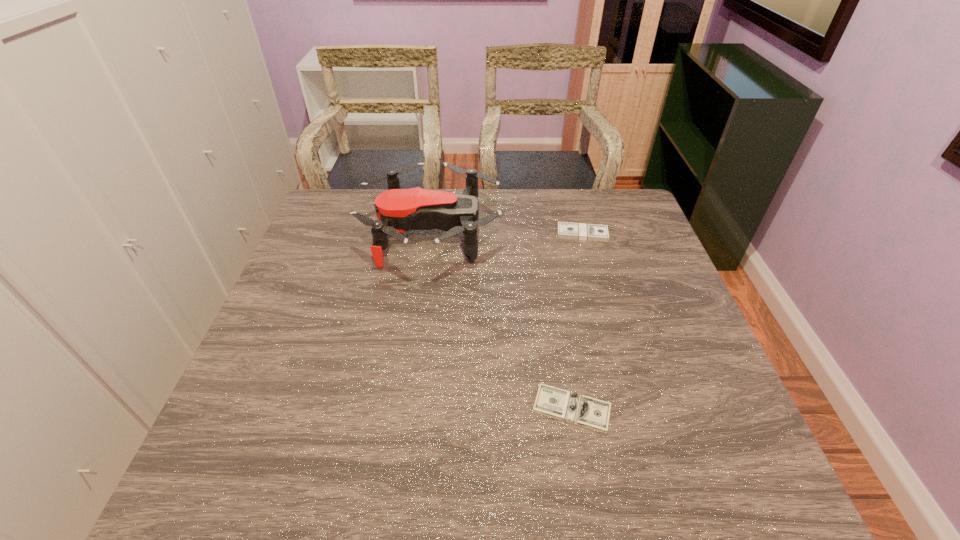
Find the location of a particular element. dollar that is positioned at the far edge is located at coordinates (565, 230).

Where is `object situated at the left edge`? Image resolution: width=960 pixels, height=540 pixels. object situated at the left edge is located at coordinates (398, 210).

In order to click on object positioned at the right edge in this screenshot , I will do `click(565, 230)`.

This screenshot has width=960, height=540. Identify the location of object that is positioned at the far left corner. (398, 210).

The image size is (960, 540). What are the coordinates of `object that is at the far right corner` in the screenshot? It's located at (565, 230).

At what (x,y) coordinates should I click in order to perform the action: click on free space at the far edge of the desktop. Please return your answer as a coordinate pair (x, y). Image resolution: width=960 pixels, height=540 pixels. Looking at the image, I should click on (577, 207).

At what (x,y) coordinates should I click in order to perform the action: click on free space at the near edge of the desktop. Please return your answer as a coordinate pair (x, y). Looking at the image, I should click on (316, 489).

Find the location of a particular element. The image size is (960, 540). free space at the left edge is located at coordinates (322, 264).

The image size is (960, 540). What are the coordinates of `vacant space at the right edge of the desktop` in the screenshot? It's located at (706, 430).

Find the location of `vacant space at the near left corner`. vacant space at the near left corner is located at coordinates click(244, 463).